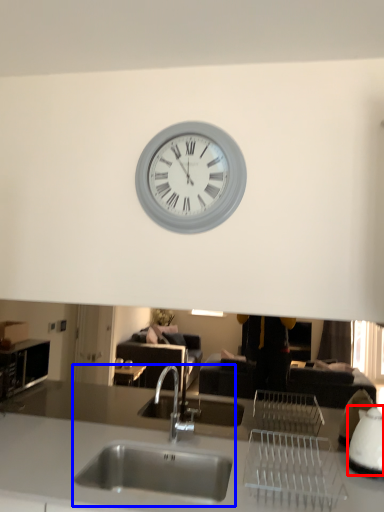
Question: Among these objects, which one is nearest to the camera, appliance (highlighted by a red box) or sink (highlighted by a blue box)?

Choices:
 (A) appliance
 (B) sink

Answer: (B)